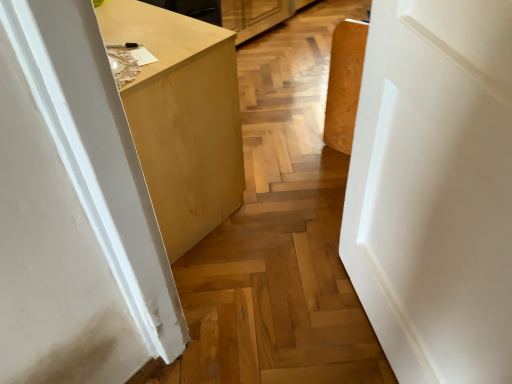
Locate an element on the screen. Image resolution: width=512 pixels, height=384 pixels. free area in between matte wood cabinet at center and white matte door at center is located at coordinates (266, 281).